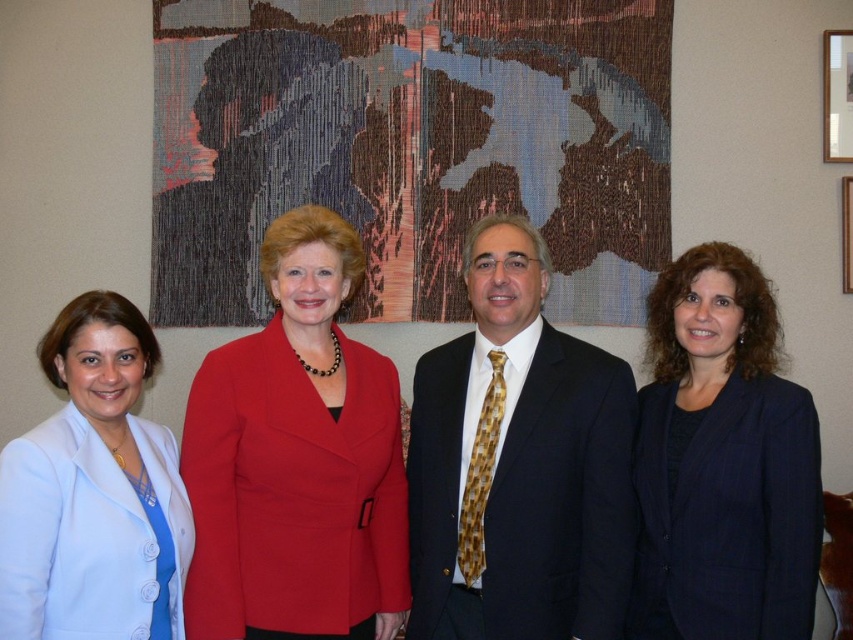
Who is lower down, dark blue suit at right or wooden picture frame at upper right?

dark blue suit at right

Is dark blue suit at right below wooden picture frame at upper right?

Correct, dark blue suit at right is located below wooden picture frame at upper right.

Based on the photo, who is more distant from viewer, (776, 536) or (834, 67)?

Point (834, 67)

Where is `dark blue suit at right`? The image size is (853, 640). dark blue suit at right is located at coordinates (722, 461).

Can you confirm if matte red blazer at center is taller than wooden frame at upper right?

Indeed, matte red blazer at center has a greater height compared to wooden frame at upper right.

Can you confirm if matte red blazer at center is bigger than wooden frame at upper right?

Yes.

Does point (219, 515) come closer to viewer compared to point (843, 228)?

That is True.

The width and height of the screenshot is (853, 640). What are the coordinates of `matte red blazer at center` in the screenshot? It's located at (297, 460).

Between matte red blazer at center and dark blue suit at right, which one appears on the right side from the viewer's perspective?

From the viewer's perspective, dark blue suit at right appears more on the right side.

Does point (316, 413) come behind point (773, 586)?

Yes, point (316, 413) is behind point (773, 586).

Find the location of a particular element. The image size is (853, 640). matte red blazer at center is located at coordinates (297, 460).